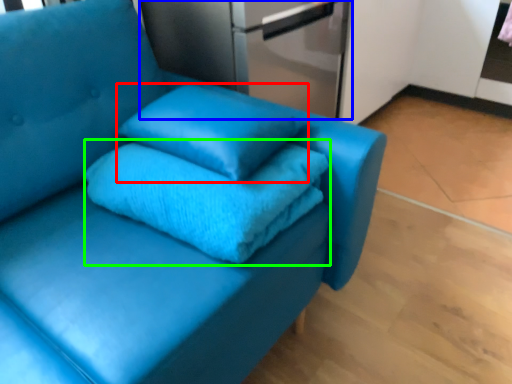
Question: Which object is positioned closest to pillow (highlighted by a red box)? Select from appliance (highlighted by a blue box) and bath towel (highlighted by a green box).

Choices:
 (A) appliance
 (B) bath towel

Answer: (B)